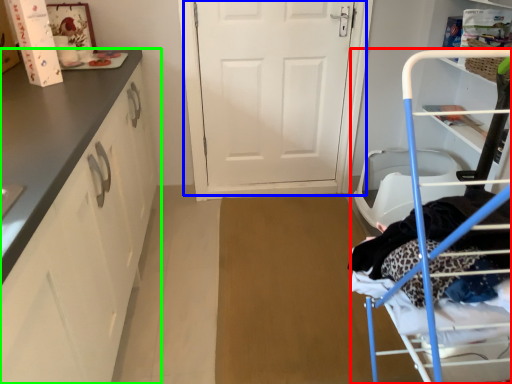
Question: Estimate the real-world distances between objects in this image. Which object is farther from furniture (highlighted by a red box), door (highlighted by a blue box) or cabinetry (highlighted by a green box)?

Choices:
 (A) door
 (B) cabinetry

Answer: (A)